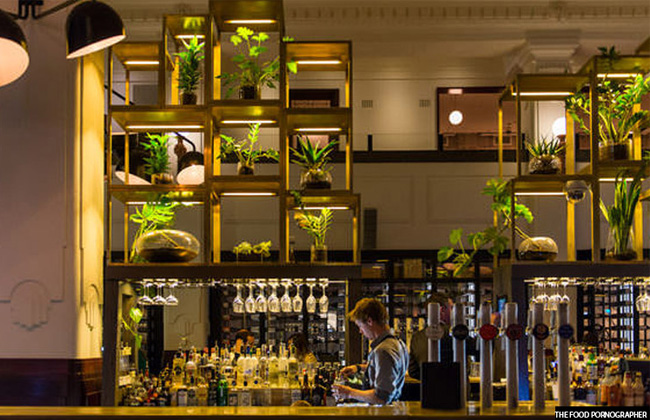
You are a GUI agent. You are given a task and a screenshot of the screen. Output one action in this format:
    pyautogui.click(x=<x>, y=<y>)
    Task: Click on the rack
    This screenshot has width=650, height=420.
    Given the screenshot: What is the action you would take?
    pyautogui.click(x=124, y=59)